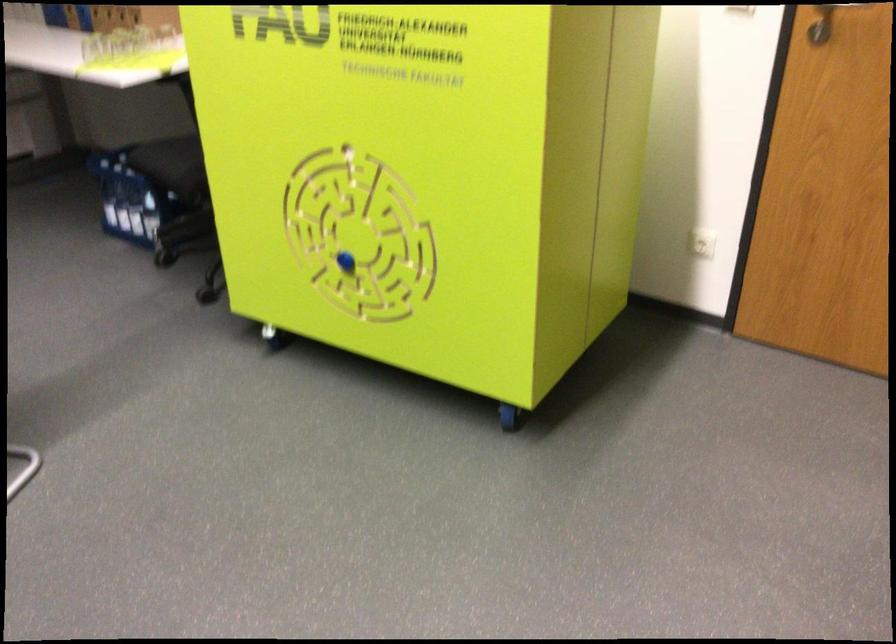
At what (x,y) coordinates should I click in order to perform the action: click on metal door handle. Please return your answer as a coordinate pair (x, y). The width and height of the screenshot is (896, 644). Looking at the image, I should click on (821, 24).